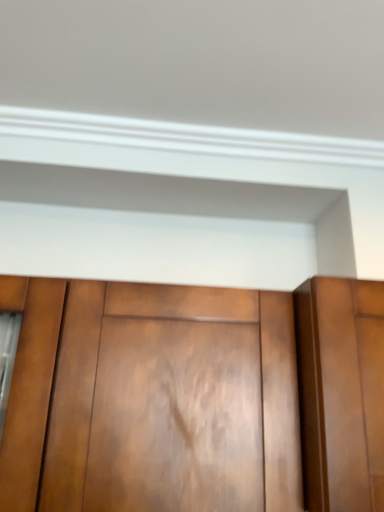
Question: Looking at their shapes, would you say shiny brown wood cupboard at center is wider or thinner than glossy wood door at center?

Choices:
 (A) wide
 (B) thin

Answer: (B)

Question: From their relative heights in the image, would you say shiny brown wood cupboard at center is taller or shorter than glossy wood door at center?

Choices:
 (A) tall
 (B) short

Answer: (A)

Question: Do you think shiny brown wood cupboard at center is within glossy wood door at center, or outside of it?

Choices:
 (A) outside
 (B) inside

Answer: (A)

Question: Is point (342, 286) closer or farther from the camera than point (253, 455)?

Choices:
 (A) farther
 (B) closer

Answer: (A)

Question: In the image, is glossy wood door at center on the left side or the right side of shiny brown wood cupboard at center?

Choices:
 (A) right
 (B) left

Answer: (A)

Question: From the image's perspective, relative to shiny brown wood cupboard at center, is glossy wood door at center above or below?

Choices:
 (A) below
 (B) above

Answer: (B)

Question: Looking at the image, does glossy wood door at center seem bigger or smaller compared to shiny brown wood cupboard at center?

Choices:
 (A) big
 (B) small

Answer: (B)